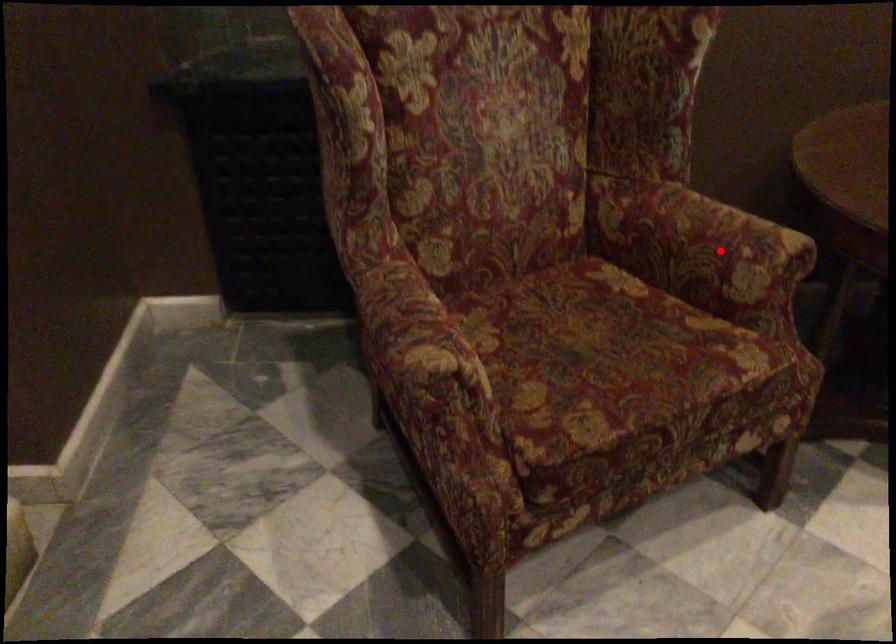
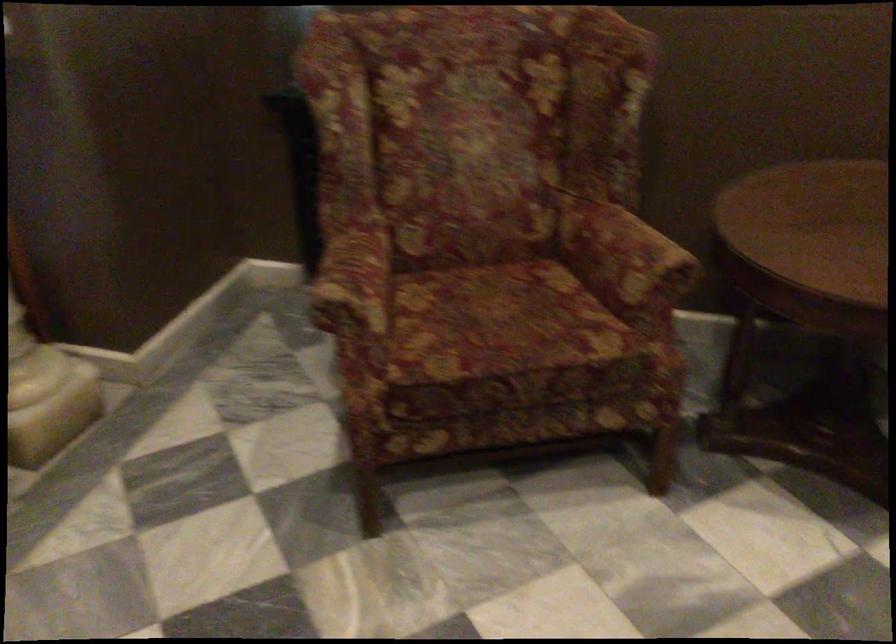
Question: I am providing you with two images of the same scene from different viewpoints. A red point is shown in image1. For the corresponding object point in image2, is it positioned nearer or farther from the camera?

Choices:
 (A) Nearer
 (B) Farther

Answer: (B)